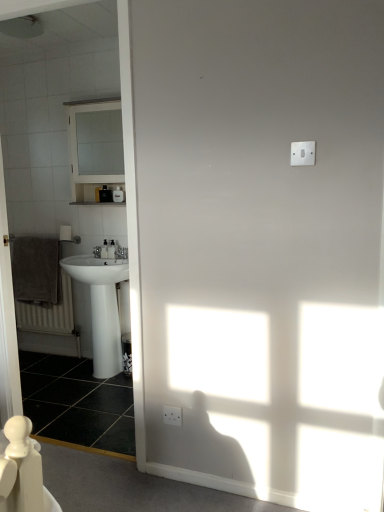
The height and width of the screenshot is (512, 384). Find the location of `black glossy tile at lower left`. black glossy tile at lower left is located at coordinates (77, 403).

Find the location of a particular element. The image size is (384, 512). white glossy medicine cabinet at upper left is located at coordinates (95, 147).

Consider the image. Which of these two, black glossy tile at lower left or white glossy sink at left, stands taller?

white glossy sink at left is taller.

Does black glossy tile at lower left have a greater width compared to white glossy sink at left?

Yes.

Is black glossy tile at lower left surrounding white glossy sink at left?

No, white glossy sink at left is located outside of black glossy tile at lower left.

Which is nearer, (94, 166) or (32, 328)?

The point (32, 328) is closer to the camera.

What's the angular difference between white glossy medicine cabinet at upper left and brown textured towel at left's facing directions?

There is a 0.336-degree angle between the facing directions of white glossy medicine cabinet at upper left and brown textured towel at left.

Can you confirm if white glossy medicine cabinet at upper left is shorter than brown textured towel at left?

In fact, white glossy medicine cabinet at upper left may be taller than brown textured towel at left.

Considering the relative positions of white glossy medicine cabinet at upper left and brown textured towel at left in the image provided, is white glossy medicine cabinet at upper left to the left of brown textured towel at left from the viewer's perspective?

Incorrect, white glossy medicine cabinet at upper left is not on the left side of brown textured towel at left.

From the image's perspective, is white glossy medicine cabinet at upper left positioned above or below black glossy tile at lower left?

Based on their image positions, white glossy medicine cabinet at upper left is located above black glossy tile at lower left.

Between white glossy medicine cabinet at upper left and black glossy tile at lower left, which one has smaller width?

With smaller width is white glossy medicine cabinet at upper left.

Based on the photo, is white glossy medicine cabinet at upper left taller or shorter than black glossy tile at lower left?

white glossy medicine cabinet at upper left is taller than black glossy tile at lower left.

Is white glossy medicine cabinet at upper left not within black glossy tile at lower left?

Yes, white glossy medicine cabinet at upper left is located beyond the bounds of black glossy tile at lower left.

Does point (64, 282) lie behind point (94, 170)?

No, (64, 282) is closer to viewer.

Is brown textured towel at left spatially inside white glossy medicine cabinet at upper left, or outside of it?

brown textured towel at left is not enclosed by white glossy medicine cabinet at upper left.

Is brown textured towel at left in front of or behind white glossy medicine cabinet at upper left in the image?

In the image, brown textured towel at left appears behind white glossy medicine cabinet at upper left.

Can you tell me how much brown textured towel at left and white glossy medicine cabinet at upper left differ in facing direction?

0.336 degrees.

Find the location of a particular element. This screenshot has width=384, height=512. tile located underneath the white glossy sink at left (from a real-world perspective) is located at coordinates (77, 403).

Is point (102, 290) farther from viewer compared to point (61, 431)?

Yes, point (102, 290) is behind point (61, 431).

Looking at their sizes, would you say white glossy sink at left is wider or thinner than black glossy tile at lower left?

white glossy sink at left is thinner than black glossy tile at lower left.

From the image's perspective, which object appears higher, white glossy sink at left or black glossy tile at lower left?

white glossy sink at left appears higher in the image.

Considering the relative sizes of white glossy medicine cabinet at upper left and white glossy sink at left in the image provided, is white glossy medicine cabinet at upper left shorter than white glossy sink at left?

Correct, white glossy medicine cabinet at upper left is not as tall as white glossy sink at left.

Considering the positions of objects white glossy medicine cabinet at upper left and white glossy sink at left in the image provided, who is more to the right, white glossy medicine cabinet at upper left or white glossy sink at left?

white glossy sink at left is more to the right.

Is white glossy medicine cabinet at upper left not near white glossy sink at left?

That's right, there is a large distance between white glossy medicine cabinet at upper left and white glossy sink at left.

From a real-world perspective, is white glossy sink at left physically below brown textured towel at left?

No, from a real-world perspective, white glossy sink at left is not under brown textured towel at left.

Looking at their sizes, would you say white glossy sink at left is wider or thinner than brown textured towel at left?

Clearly, white glossy sink at left has more width compared to brown textured towel at left.

Is white glossy sink at left oriented towards brown textured towel at left?

No, white glossy sink at left is not turned towards brown textured towel at left.

Considering the sizes of white glossy sink at left and brown textured towel at left in the image, is white glossy sink at left bigger or smaller than brown textured towel at left?

white glossy sink at left is bigger than brown textured towel at left.

The height and width of the screenshot is (512, 384). Identify the location of tile that is below the white glossy sink at left (from the image's perspective). (77, 403).

Where is `medicine cabinet positioned vertically above the brown textured towel at left (from a real-world perspective)`? medicine cabinet positioned vertically above the brown textured towel at left (from a real-world perspective) is located at coordinates (95, 147).

Estimate the real-world distances between objects in this image. Which object is closer to brown textured towel at left, white glossy sink at left or black glossy tile at lower left?

The object closer to brown textured towel at left is white glossy sink at left.

Considering their positions, is white glossy medicine cabinet at upper left positioned closer to brown textured towel at left than white glossy sink at left?

white glossy sink at left is closer to brown textured towel at left.

When comparing their distances from white glossy medicine cabinet at upper left, does brown textured towel at left or black glossy tile at lower left seem further?

The object further to white glossy medicine cabinet at upper left is black glossy tile at lower left.

From the image, which object appears to be farther from black glossy tile at lower left, white glossy medicine cabinet at upper left or brown textured towel at left?

Among the two, white glossy medicine cabinet at upper left is located further to black glossy tile at lower left.

From the image, which object appears to be farther from white glossy sink at left, black glossy tile at lower left or brown textured towel at left?

brown textured towel at left.

In the scene shown: Estimate the real-world distances between objects in this image. Which object is further from white glossy sink at left, white glossy medicine cabinet at upper left or brown textured towel at left?

Among the two, white glossy medicine cabinet at upper left is located further to white glossy sink at left.

Which object lies further to the anchor point white glossy sink at left, white glossy medicine cabinet at upper left or black glossy tile at lower left?

white glossy medicine cabinet at upper left is positioned further to the anchor white glossy sink at left.

Based on their spatial positions, is white glossy sink at left or white glossy medicine cabinet at upper left closer to black glossy tile at lower left?

Among the two, white glossy sink at left is located nearer to black glossy tile at lower left.

Find the location of a particular element. radiator between white glossy medicine cabinet at upper left and black glossy tile at lower left vertically is located at coordinates (48, 313).

Image resolution: width=384 pixels, height=512 pixels. I want to click on sink between white glossy medicine cabinet at upper left and brown textured towel at left from top to bottom, so click(102, 307).

Find the location of a particular element. This screenshot has width=384, height=512. sink between black glossy tile at lower left and brown textured towel at left along the z-axis is located at coordinates (102, 307).

You are a GUI agent. You are given a task and a screenshot of the screen. Output one action in this format:
    pyautogui.click(x=<x>, y=<y>)
    Task: Click on the sink between white glossy medicine cabinet at upper left and black glossy tile at lower left vertically
    This screenshot has height=512, width=384.
    Given the screenshot: What is the action you would take?
    pos(102,307)